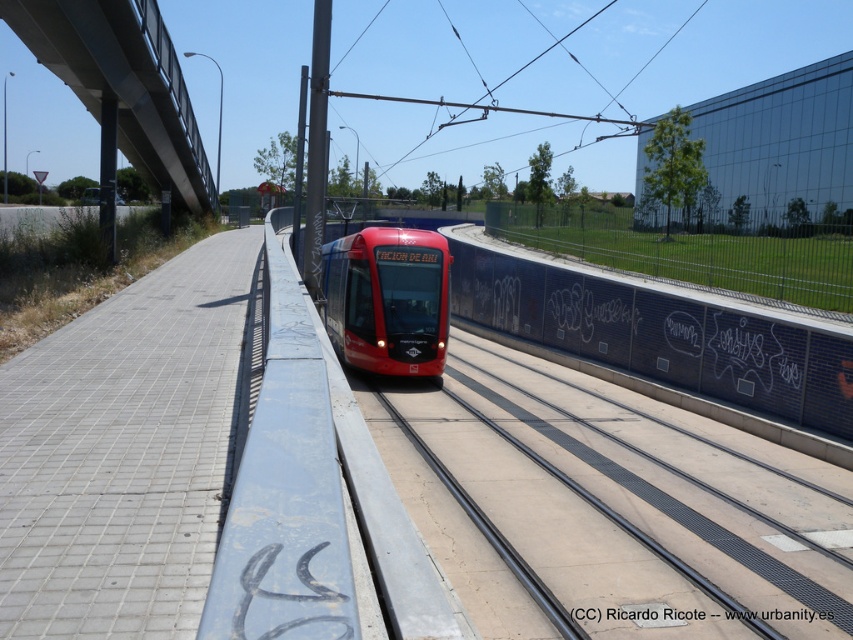
You are a maintenance worker needing to reach the blacktexturedsign at center from the matte red train at center. Given that your reach extends 2 meters, can you access the sign without any equipment?

The matte red train at center is 11.64 meters away from the blacktexturedsign at center. Since your reach only extends 2 meters, you cannot access the sign without additional equipment.